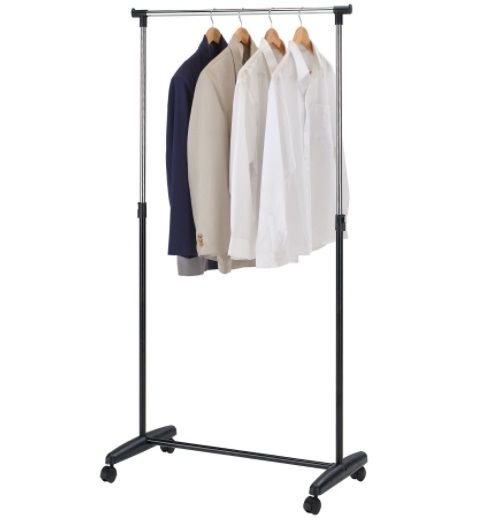
Where is `rods`? rods is located at coordinates (220, 452), (141, 378), (343, 316), (277, 7).